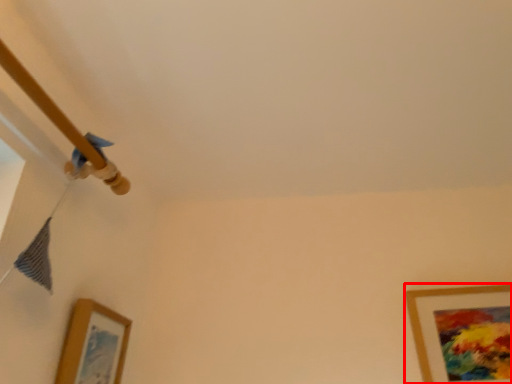
Question: Where is picture frame (annotated by the red box) located in relation to picture frame in the image?

Choices:
 (A) right
 (B) left

Answer: (A)